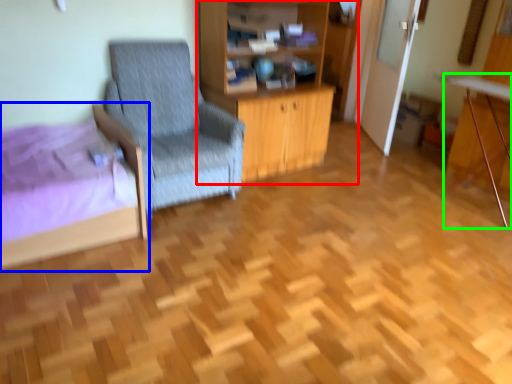
Question: Which is farther away from dresser (highlighted by a red box)? bed (highlighted by a blue box) or computer desk (highlighted by a green box)?

Choices:
 (A) bed
 (B) computer desk

Answer: (B)